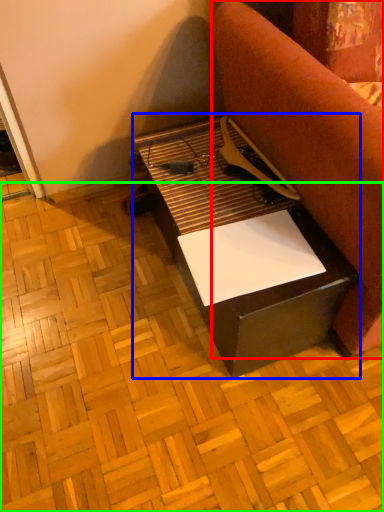
Question: Based on their relative distances, which object is farther from furniture (highlighted by a red box)? Choose from table (highlighted by a blue box) and plywood (highlighted by a green box).

Choices:
 (A) table
 (B) plywood

Answer: (B)